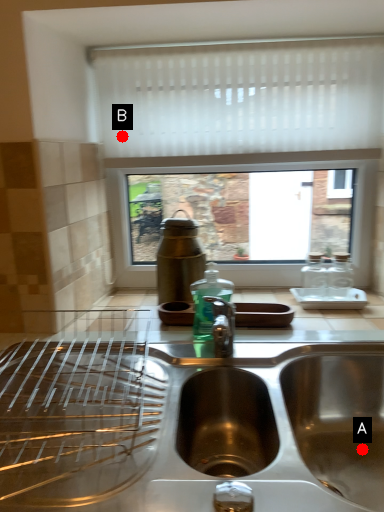
Question: Two points are circled on the image, labeled by A and B beside each circle. Which point is further to the camera?

Choices:
 (A) A is further
 (B) B is further

Answer: (B)